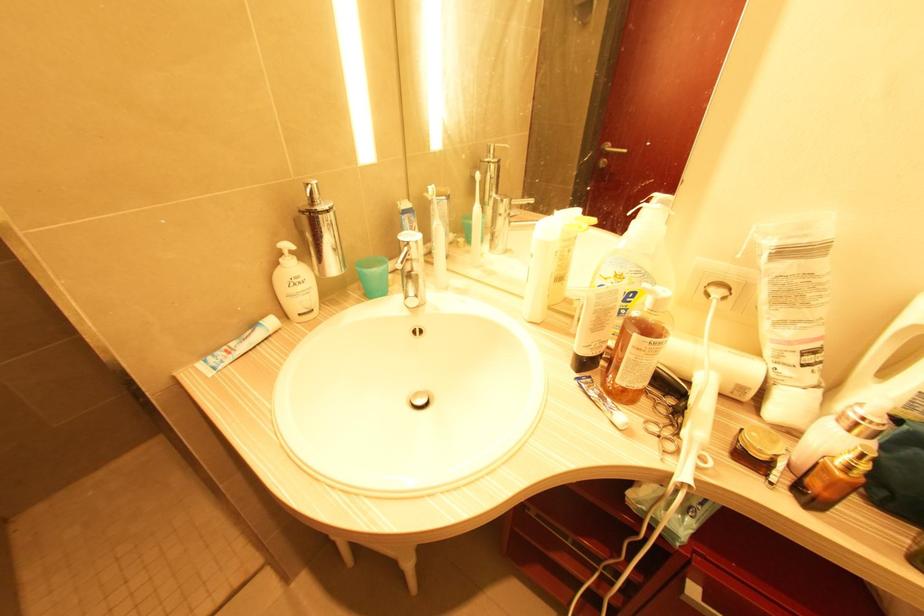
What do you see at coordinates (565, 249) in the screenshot? I see `the yellow spray nozzle` at bounding box center [565, 249].